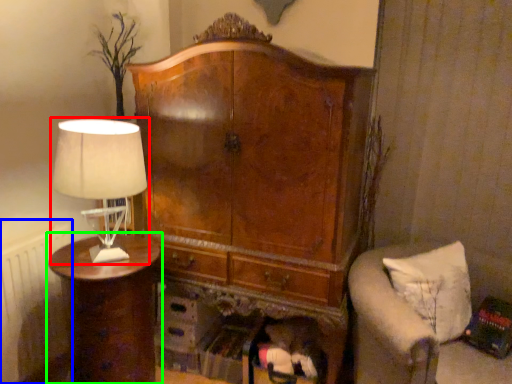
Question: Which object is positioned farthest from lamp (highlighted by a red box)? Select from radiator (highlighted by a blue box) and nightstand (highlighted by a green box).

Choices:
 (A) radiator
 (B) nightstand

Answer: (A)